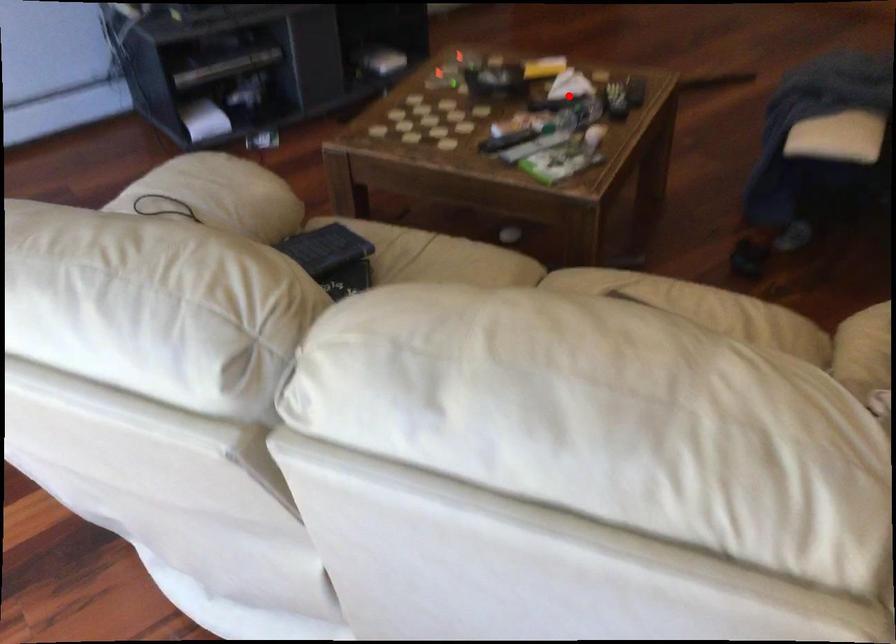
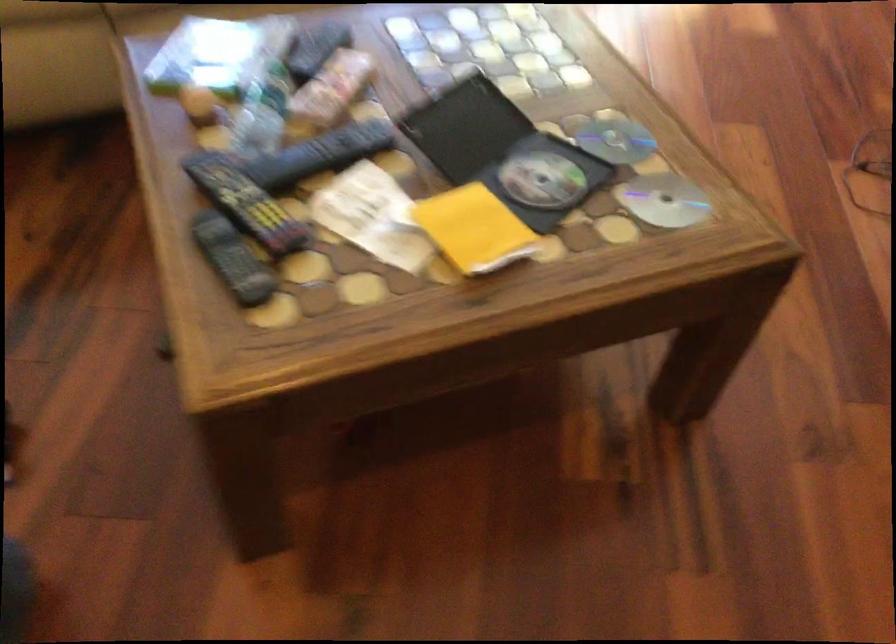
In the second image, find the point that corresponds to the highlighted location in the first image.

(320, 154)